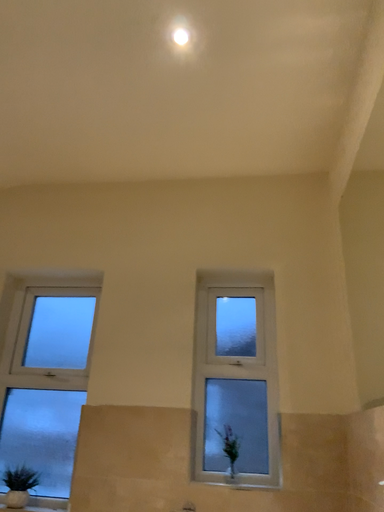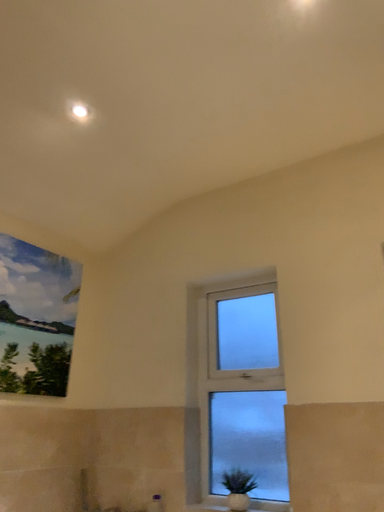
Question: Which way did the camera rotate in the video?

Choices:
 (A) rotated right
 (B) rotated left

Answer: (B)